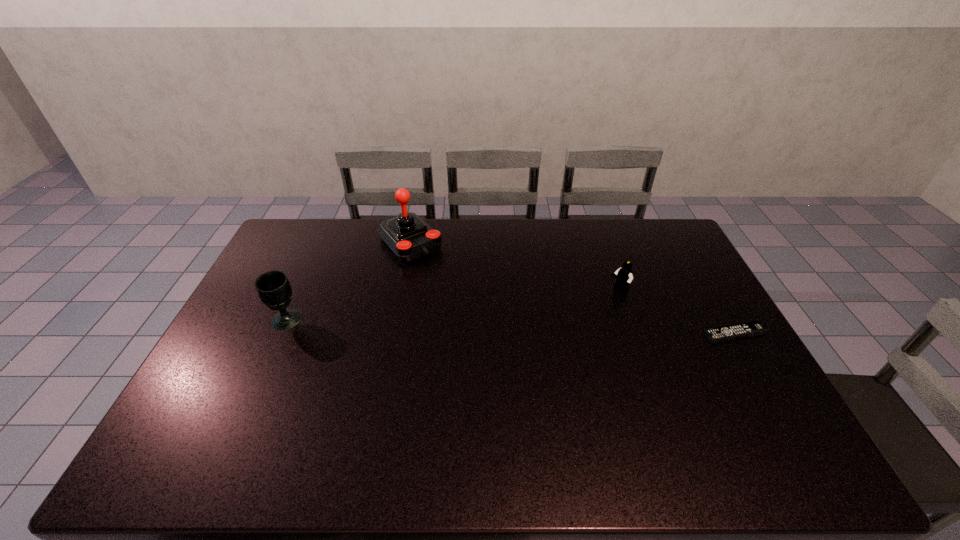
Locate an element on the screen. Image resolution: width=960 pixels, height=540 pixels. vacant spot on the desktop that is between the chalice and the rightmost object and is positioned on the front-facing side of the second farthest object is located at coordinates (557, 328).

You are a GUI agent. You are given a task and a screenshot of the screen. Output one action in this format:
    pyautogui.click(x=<x>, y=<y>)
    Task: Click on the vacant space on the desktop that is between the chalice and the remote control and is positioned on the base of the joystick
    
    Given the screenshot: What is the action you would take?
    (x=489, y=326)